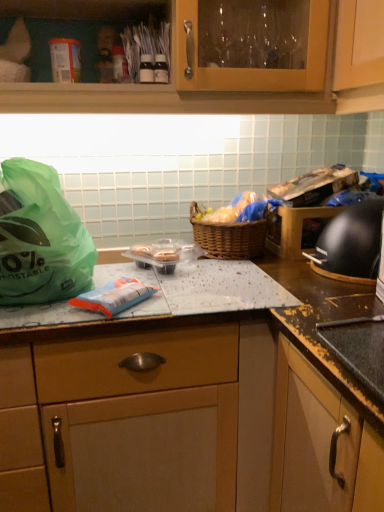
Question: Can we say white cardboard canister at upper left lies outside green plastic bag at left?

Choices:
 (A) yes
 (B) no

Answer: (A)

Question: Is white cardboard canister at upper left at the left side of green plastic bag at left?

Choices:
 (A) no
 (B) yes

Answer: (A)

Question: Is white cardboard canister at upper left positioned before green plastic bag at left?

Choices:
 (A) no
 (B) yes

Answer: (A)

Question: Could you tell me if white cardboard canister at upper left is facing green plastic bag at left?

Choices:
 (A) no
 (B) yes

Answer: (A)

Question: Does white cardboard canister at upper left have a lesser width compared to green plastic bag at left?

Choices:
 (A) no
 (B) yes

Answer: (B)

Question: From the image's perspective, is white cardboard canister at upper left located above or below green plastic bag at left?

Choices:
 (A) below
 (B) above

Answer: (B)

Question: Considering the positions of white cardboard canister at upper left and green plastic bag at left in the image, is white cardboard canister at upper left bigger or smaller than green plastic bag at left?

Choices:
 (A) small
 (B) big

Answer: (A)

Question: In terms of height, does white cardboard canister at upper left look taller or shorter compared to green plastic bag at left?

Choices:
 (A) short
 (B) tall

Answer: (A)

Question: From a real-world perspective, is white cardboard canister at upper left above or below green plastic bag at left?

Choices:
 (A) above
 (B) below

Answer: (A)

Question: In terms of size, does green plastic bag at left appear bigger or smaller than black matte gas stove at right?

Choices:
 (A) big
 (B) small

Answer: (A)

Question: Does point (34, 203) appear closer or farther from the camera than point (352, 242)?

Choices:
 (A) closer
 (B) farther

Answer: (A)

Question: In the image, is green plastic bag at left positioned in front of or behind black matte gas stove at right?

Choices:
 (A) front
 (B) behind

Answer: (A)

Question: From a real-world perspective, relative to black matte gas stove at right, is green plastic bag at left vertically above or below?

Choices:
 (A) below
 (B) above

Answer: (B)

Question: Is point click(374, 420) positioned closer to the camera than point click(21, 178)?

Choices:
 (A) closer
 (B) farther

Answer: (A)

Question: Based on their sizes in the image, would you say black granite countertop at center is bigger or smaller than green plastic bag at left?

Choices:
 (A) big
 (B) small

Answer: (A)